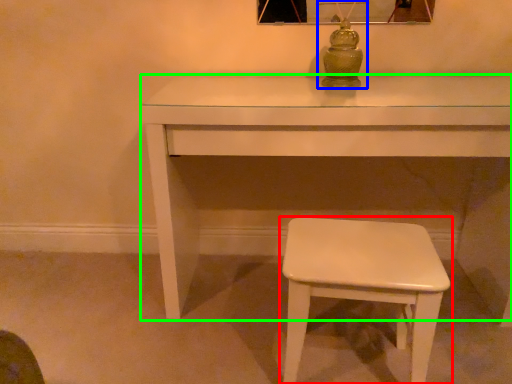
Question: Considering the real-world distances, which object is farthest from stool (highlighted by a red box)? table lamp (highlighted by a blue box) or table (highlighted by a green box)?

Choices:
 (A) table lamp
 (B) table

Answer: (A)